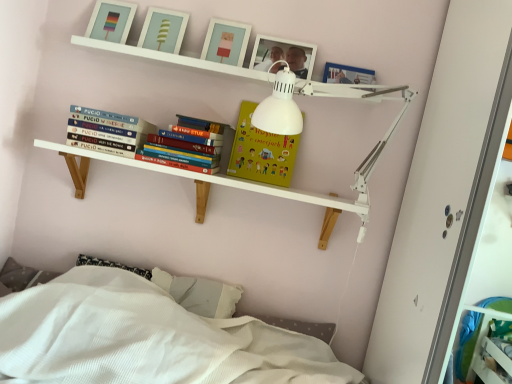
The image size is (512, 384). I want to click on blue hardcover book at left, so click(x=110, y=128).

The width and height of the screenshot is (512, 384). What do you see at coordinates (111, 21) in the screenshot?
I see `matte plastic picture frame at upper center, the 1th picture frame viewed from the left` at bounding box center [111, 21].

Image resolution: width=512 pixels, height=384 pixels. Describe the element at coordinates (376, 143) in the screenshot. I see `white plastic lamp at upper center` at that location.

This screenshot has height=384, width=512. What do you see at coordinates (347, 74) in the screenshot?
I see `wooden picture frame at upper center, which ranks as the fifth picture frame in left-to-right order` at bounding box center [347, 74].

Identify the location of matte white picture frame at upper center, which is counted as the 3th picture frame, starting from the left. The image size is (512, 384). (226, 42).

At what (x,y) coordinates should I click in order to perform the action: click on blue hardcover book at left. Please return your answer as a coordinate pair (x, y). Looking at the image, I should click on (110, 128).

Does yellow matte paper at upper center touch matte plastic picture frame at upper center, the fifth picture frame in the right-to-left sequence?

yellow matte paper at upper center and matte plastic picture frame at upper center, the fifth picture frame in the right-to-left sequence, are not in contact.

Between yellow matte paper at upper center and matte plastic picture frame at upper center, the fifth picture frame in the right-to-left sequence, which one has more height?

yellow matte paper at upper center.

Can matte plastic picture frame at upper center, the fifth picture frame in the right-to-left sequence, be found inside yellow matte paper at upper center?

No.

Is matte white picture frame at upper center, marked as the 2th picture frame in a left-to-right arrangement, outside of white matte shelf at upper center, acting as the first shelf starting from the top?

Absolutely, matte white picture frame at upper center, marked as the 2th picture frame in a left-to-right arrangement, is external to white matte shelf at upper center, acting as the first shelf starting from the top.

From the image's perspective, would you say matte white picture frame at upper center, the fourth picture frame viewed from the right, is shown under white matte shelf at upper center, acting as the first shelf starting from the top?

No.

Consider the image. Is matte white picture frame at upper center, the fourth picture frame viewed from the right, looking in the opposite direction of white matte shelf at upper center, acting as the first shelf starting from the top?

No, white matte shelf at upper center, acting as the first shelf starting from the top, is not at the back of matte white picture frame at upper center, the fourth picture frame viewed from the right.

Which object is thinner, matte white picture frame at upper center, the fourth picture frame viewed from the right, or white matte shelf at upper center, acting as the first shelf starting from the top?

matte white picture frame at upper center, the fourth picture frame viewed from the right.

Based on the photo, from a real-world perspective, is matte plastic picture frame at upper center, the fifth picture frame in the right-to-left sequence, beneath yellow matte paper at upper center?

Actually, matte plastic picture frame at upper center, the fifth picture frame in the right-to-left sequence, is physically above yellow matte paper at upper center in the real world.

From the image's perspective, is matte plastic picture frame at upper center, the fifth picture frame in the right-to-left sequence, positioned above or below yellow matte paper at upper center?

matte plastic picture frame at upper center, the fifth picture frame in the right-to-left sequence, is above yellow matte paper at upper center.

Is yellow matte paper at upper center at the back of matte plastic picture frame at upper center, the 1th picture frame viewed from the left?

No, yellow matte paper at upper center is not at the back of matte plastic picture frame at upper center, the 1th picture frame viewed from the left.

What's the angular difference between matte plastic picture frame at upper center, the 1th picture frame viewed from the left, and yellow matte paper at upper center's facing directions?

There is a 0.506-degree angle between the facing directions of matte plastic picture frame at upper center, the 1th picture frame viewed from the left, and yellow matte paper at upper center.

From a real-world perspective, is matte white picture frame at upper center, marked as the 2th picture frame in a left-to-right arrangement, above or below matte white picture frame at upper center, the 3th picture frame from the right?

matte white picture frame at upper center, marked as the 2th picture frame in a left-to-right arrangement, is situated lower than matte white picture frame at upper center, the 3th picture frame from the right, in the real world.

Identify the location of the 1st picture frame above when counting from the matte white picture frame at upper center, which is counted as the 3th picture frame, starting from the left (from the image's perspective). (163, 30).

Between matte white picture frame at upper center, marked as the 2th picture frame in a left-to-right arrangement, and matte white picture frame at upper center, which is counted as the 3th picture frame, starting from the left, which one appears on the right side from the viewer's perspective?

matte white picture frame at upper center, which is counted as the 3th picture frame, starting from the left.

Considering the points (156, 14) and (230, 58), which point is behind, point (156, 14) or point (230, 58)?

The point (156, 14) is more distant.

Where is `the 2nd picture frame counting from the right side of the matte white picture frame at upper center, the 3th picture frame from the right`? This screenshot has width=512, height=384. the 2nd picture frame counting from the right side of the matte white picture frame at upper center, the 3th picture frame from the right is located at coordinates (347, 74).

From the picture: From the image's perspective, is matte white picture frame at upper center, the 3th picture frame from the right, positioned above or below wooden picture frame at upper center, positioned as the first picture frame in right-to-left order?

matte white picture frame at upper center, the 3th picture frame from the right, is above wooden picture frame at upper center, positioned as the first picture frame in right-to-left order.

Between matte white picture frame at upper center, the 3th picture frame from the right, and wooden picture frame at upper center, positioned as the first picture frame in right-to-left order, which one appears on the right side from the viewer's perspective?

From the viewer's perspective, wooden picture frame at upper center, positioned as the first picture frame in right-to-left order, appears more on the right side.

In terms of height, does matte white picture frame at upper center, which is counted as the 3th picture frame, starting from the left, look taller or shorter compared to wooden picture frame at upper center, which ranks as the fifth picture frame in left-to-right order?

Considering their sizes, matte white picture frame at upper center, which is counted as the 3th picture frame, starting from the left, has more height than wooden picture frame at upper center, which ranks as the fifth picture frame in left-to-right order.

Considering the sizes of wooden picture frame at upper center, which is the fourth picture frame in left-to-right order, and matte plastic picture frame at upper center, the 1th picture frame viewed from the left, in the image, is wooden picture frame at upper center, which is the fourth picture frame in left-to-right order, taller or shorter than matte plastic picture frame at upper center, the 1th picture frame viewed from the left,?

Clearly, wooden picture frame at upper center, which is the fourth picture frame in left-to-right order, is shorter compared to matte plastic picture frame at upper center, the 1th picture frame viewed from the left.

Image resolution: width=512 pixels, height=384 pixels. There is a matte plastic picture frame at upper center, the fifth picture frame in the right-to-left sequence. What are the coordinates of `the 3rd picture frame below it (from a real-world perspective)` in the screenshot? It's located at coord(283,55).

From a real-world perspective, who is located higher, wooden picture frame at upper center, which is the fourth picture frame in left-to-right order, or matte plastic picture frame at upper center, the 1th picture frame viewed from the left?

In real-world perspective, matte plastic picture frame at upper center, the 1th picture frame viewed from the left, is above.

Is point (276, 65) behind point (113, 20)?

That is False.

From the image's perspective, relative to matte plastic picture frame at upper center, the 1th picture frame viewed from the left, is white matte shelf at upper center, marked as the 2th shelf in a bottom-to-top arrangement, above or below?

Clearly, from the image's perspective, white matte shelf at upper center, marked as the 2th shelf in a bottom-to-top arrangement, is below matte plastic picture frame at upper center, the 1th picture frame viewed from the left.

From a real-world perspective, is white matte shelf at upper center, marked as the 2th shelf in a bottom-to-top arrangement, physically above matte plastic picture frame at upper center, the 1th picture frame viewed from the left?

Incorrect, from a real-world perspective, white matte shelf at upper center, marked as the 2th shelf in a bottom-to-top arrangement, is lower than matte plastic picture frame at upper center, the 1th picture frame viewed from the left.

Is the surface of white matte shelf at upper center, acting as the first shelf starting from the top, in direct contact with matte plastic picture frame at upper center, the fifth picture frame in the right-to-left sequence?

No, white matte shelf at upper center, acting as the first shelf starting from the top, is not in contact with matte plastic picture frame at upper center, the fifth picture frame in the right-to-left sequence.

The image size is (512, 384). What are the coordinates of `the 3rd picture frame to the left when counting from the yellow matte paper at upper center` in the screenshot? It's located at (111, 21).

Which shelf is the 1st one when counting from the front of the matte white picture frame at upper center, marked as the 2th picture frame in a left-to-right arrangement? Please provide its 2D coordinates.

[(173, 58)]

Considering their positions, is white wooden shelf at upper center, marked as the first shelf in a bottom-to-top arrangement, positioned further to matte plastic picture frame at upper center, the fifth picture frame in the right-to-left sequence, than white plastic lamp at upper center?

white plastic lamp at upper center is further to matte plastic picture frame at upper center, the fifth picture frame in the right-to-left sequence.

When comparing their distances from yellow matte paper at upper center, does blue hardcover book at left or matte plastic picture frame at upper center, the 1th picture frame viewed from the left, seem further?

matte plastic picture frame at upper center, the 1th picture frame viewed from the left, lies further to yellow matte paper at upper center than the other object.

Based on their spatial positions, is matte plastic picture frame at upper center, the fifth picture frame in the right-to-left sequence, or wooden picture frame at upper center, which ranks as the fifth picture frame in left-to-right order, closer to blue hardcover book at left?

The object closer to blue hardcover book at left is matte plastic picture frame at upper center, the fifth picture frame in the right-to-left sequence.

Considering their positions, is yellow matte paper at upper center positioned further to matte white picture frame at upper center, the fourth picture frame viewed from the right, than white matte shelf at upper center, acting as the first shelf starting from the top?

The object further to matte white picture frame at upper center, the fourth picture frame viewed from the right, is yellow matte paper at upper center.

Estimate the real-world distances between objects in this image. Which object is closer to matte plastic picture frame at upper center, the 1th picture frame viewed from the left, blue hardcover book at left or matte white picture frame at upper center, marked as the 2th picture frame in a left-to-right arrangement?

The object closer to matte plastic picture frame at upper center, the 1th picture frame viewed from the left, is matte white picture frame at upper center, marked as the 2th picture frame in a left-to-right arrangement.

Based on their spatial positions, is yellow matte paper at upper center or wooden picture frame at upper center, which ranks as the fifth picture frame in left-to-right order, further from white plastic lamp at upper center?

wooden picture frame at upper center, which ranks as the fifth picture frame in left-to-right order, is further to white plastic lamp at upper center.

In the scene shown: Based on their spatial positions, is matte white picture frame at upper center, marked as the 2th picture frame in a left-to-right arrangement, or blue hardcover book at left further from wooden picture frame at upper center, which ranks as the fifth picture frame in left-to-right order?

Among the two, blue hardcover book at left is located further to wooden picture frame at upper center, which ranks as the fifth picture frame in left-to-right order.

From the image, which object appears to be farther from white matte shelf at upper center, marked as the 2th shelf in a bottom-to-top arrangement, white plastic lamp at upper center or white wooden shelf at upper center, which is counted as the second shelf, starting from the top?

white wooden shelf at upper center, which is counted as the second shelf, starting from the top.

Where is `book between matte plastic picture frame at upper center, the fifth picture frame in the right-to-left sequence, and white plastic lamp at upper center`? This screenshot has height=384, width=512. book between matte plastic picture frame at upper center, the fifth picture frame in the right-to-left sequence, and white plastic lamp at upper center is located at coordinates (110, 128).

In order to click on shelf between wooden picture frame at upper center, placed as the 2th picture frame when sorted from right to left, and white plastic lamp at upper center, in the vertical direction in this screenshot , I will do `click(173, 58)`.

I want to click on paperback book between matte plastic picture frame at upper center, the fifth picture frame in the right-to-left sequence, and wooden picture frame at upper center, which is the fourth picture frame in left-to-right order, so 261,152.

The height and width of the screenshot is (384, 512). Find the location of `picture frame situated between matte plastic picture frame at upper center, the 1th picture frame viewed from the left, and white matte shelf at upper center, marked as the 2th shelf in a bottom-to-top arrangement, from left to right`. picture frame situated between matte plastic picture frame at upper center, the 1th picture frame viewed from the left, and white matte shelf at upper center, marked as the 2th shelf in a bottom-to-top arrangement, from left to right is located at coordinates (163, 30).